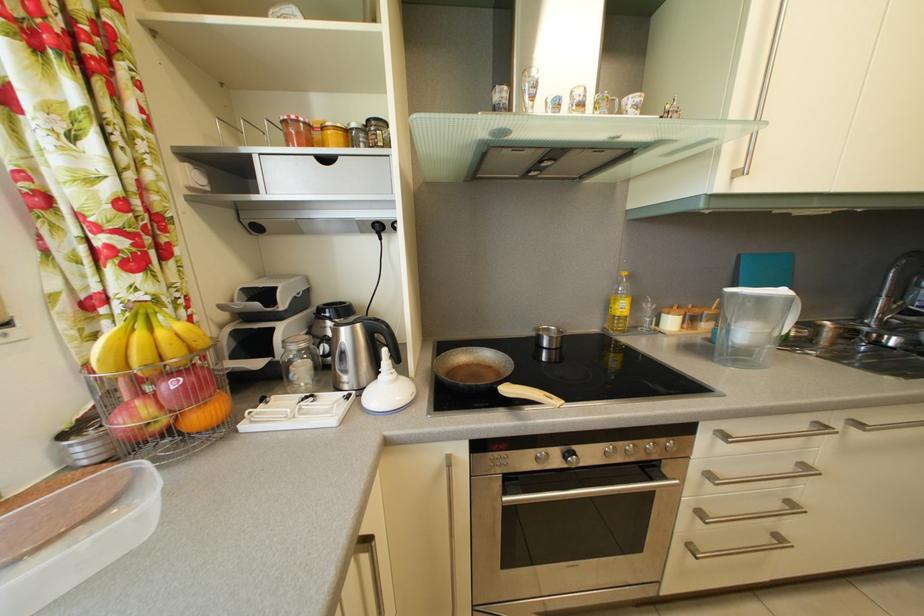
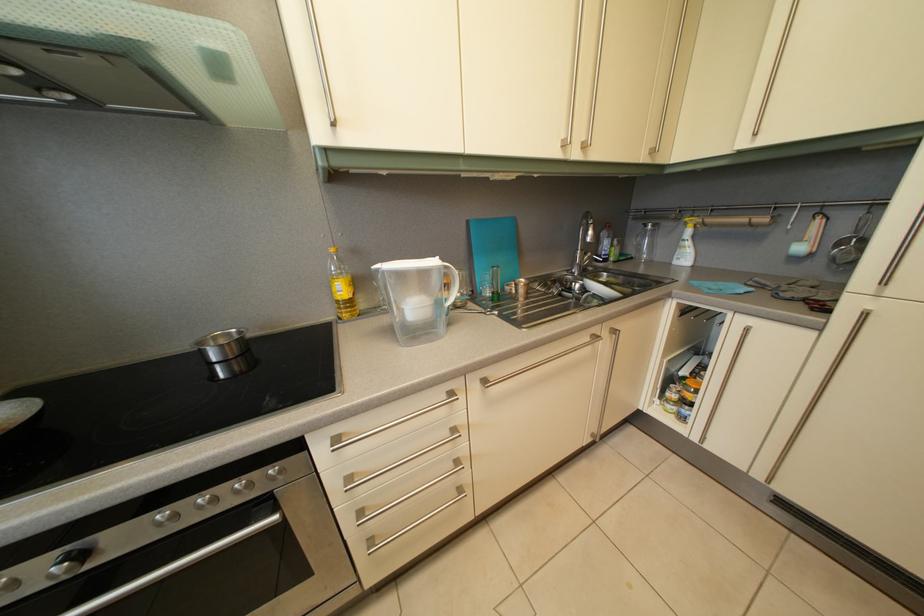
Where in the second image is the point corresponding to (629,315) from the first image?

(349, 297)